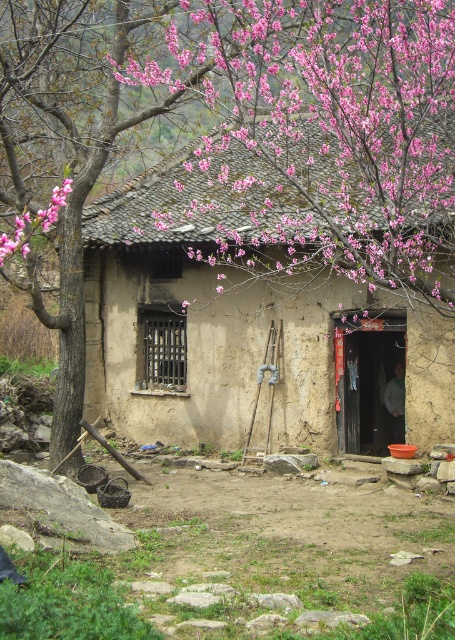
You are a painter planning to paint the brown mud hut at center and the pink bloom at upper center. You have a limited amount of paint. Which object requires more paint to cover its entire width?

The brown mud hut at center requires more paint to cover its entire width because its width surpasses that of the pink bloom at upper center.

You are standing in the courtyard of the brown mud hut at center and want to take a photo of it with your camera. If the recommended distance for capturing the entire structure in one frame is 25 feet, will you need to move closer or farther away?

The brown mud hut at center and camera are 25.73 feet apart from each other. Since the recommended distance is 25 feet, you need to move slightly closer to ensure the entire structure fits in the frame.

You are standing in the courtyard of the brown mud hut at center. If you face the entrance of the house, which direction should you walk to reach the wooden tools leaning against the wall?

The wooden tools are located near the entrance, so you should walk towards the entrance of the brown mud hut at center to reach them.